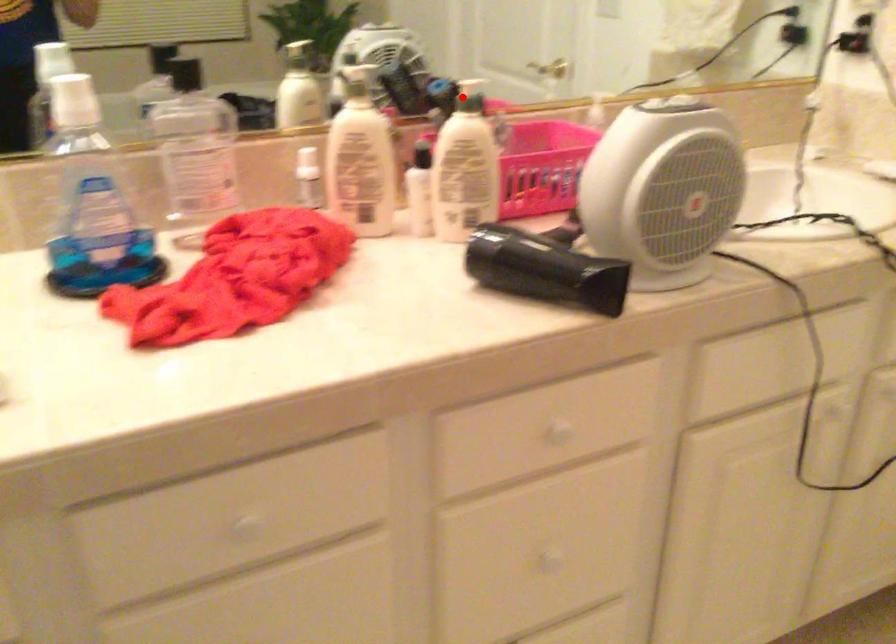
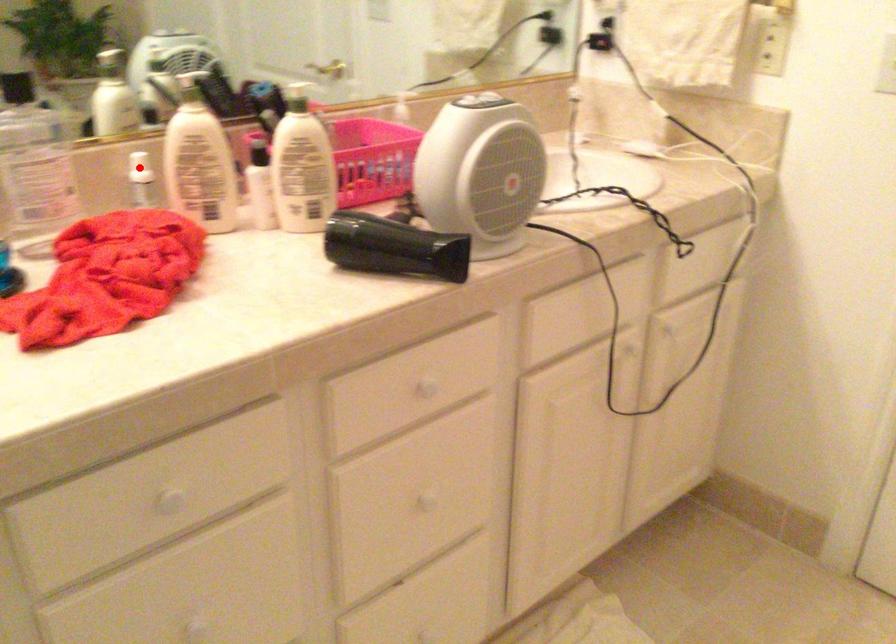
I am providing you with two images of the same scene from different viewpoints. A red point is marked on the first image and another point is marked on the second image. Do the highlighted points in image1 and image2 indicate the same real-world spot?

No